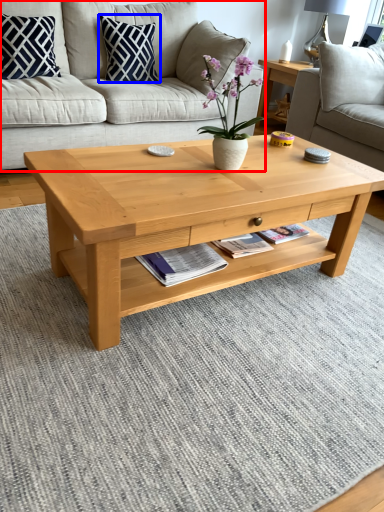
Question: Which of the following is the closest to the observer, studio couch (highlighted by a red box) or pillow (highlighted by a blue box)?

Choices:
 (A) studio couch
 (B) pillow

Answer: (A)